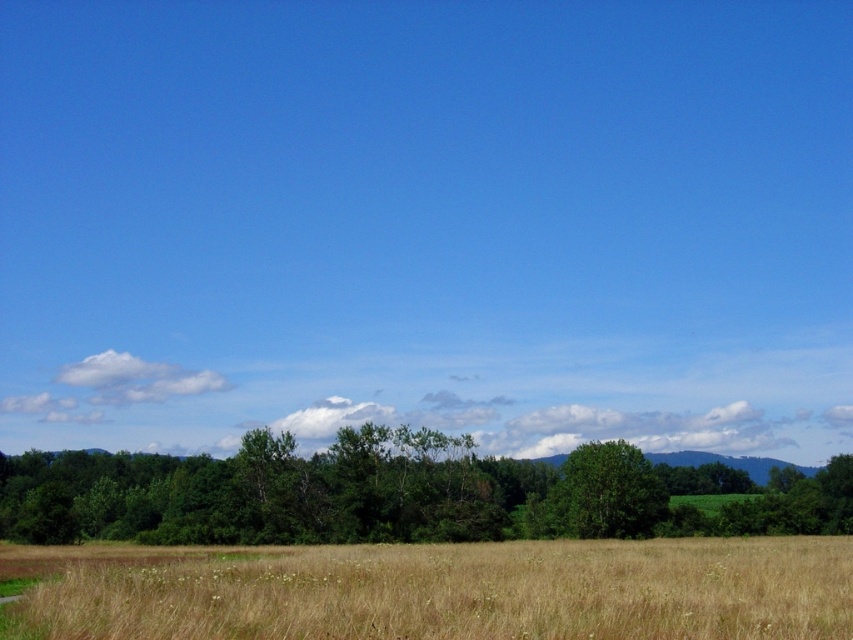
Question: Is brown grassy field at lower center smaller than green leafy tree at center?

Choices:
 (A) no
 (B) yes

Answer: (B)

Question: Can you confirm if brown grassy field at lower center is positioned to the right of green leafy tree at center?

Choices:
 (A) yes
 (B) no

Answer: (B)

Question: Which point is closer to the camera?

Choices:
 (A) (595, 472)
 (B) (337, 570)

Answer: (B)

Question: Which object is positioned farthest from the green matte tree at center?

Choices:
 (A) brown grassy field at lower center
 (B) green leafy tree at center

Answer: (A)

Question: Among these points, which one is farthest from the camera?

Choices:
 (A) (19, 636)
 (B) (596, 454)

Answer: (B)

Question: Where is brown grassy field at lower center located in relation to green leafy tree at center in the image?

Choices:
 (A) left
 (B) right

Answer: (A)